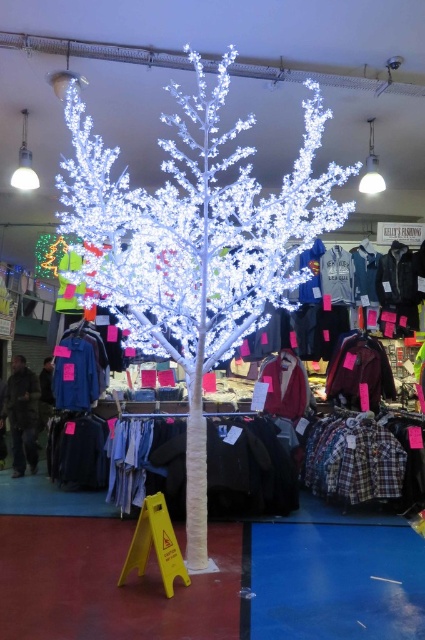
Is white textured tree at center above blue denim shirt at left?

Indeed, white textured tree at center is positioned over blue denim shirt at left.

Find the location of `white textured tree at center`. white textured tree at center is located at coordinates (195, 244).

Who is shorter, velvet maroon jacket at center or dark brown leather jacket at left?

With less height is velvet maroon jacket at center.

Is velvet maroon jacket at center wider than dark brown leather jacket at left?

Yes, velvet maroon jacket at center is wider than dark brown leather jacket at left.

Identify the location of velvet maroon jacket at center. This screenshot has width=425, height=640. (359, 371).

Find the location of a particular element. velvet maroon jacket at center is located at coordinates [x=359, y=371].

Can you confirm if white textured tree at center is positioned to the left of dark brown leather jacket at left?

No, white textured tree at center is not to the left of dark brown leather jacket at left.

The width and height of the screenshot is (425, 640). What do you see at coordinates (195, 244) in the screenshot? I see `white textured tree at center` at bounding box center [195, 244].

This screenshot has width=425, height=640. What are the coordinates of `white textured tree at center` in the screenshot? It's located at (195, 244).